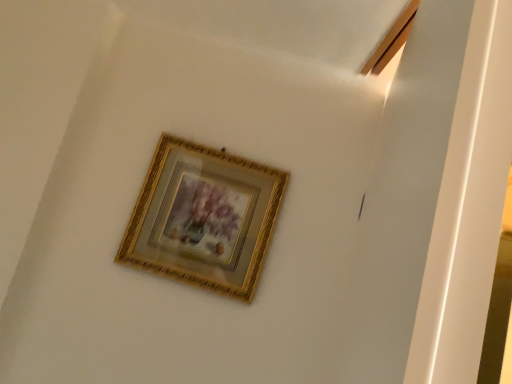
Describe the element at coordinates (204, 218) in the screenshot. This screenshot has width=512, height=384. I see `gold/gilded picture frame at upper center` at that location.

The height and width of the screenshot is (384, 512). I want to click on gold/gilded picture frame at upper center, so click(204, 218).

This screenshot has height=384, width=512. In order to click on gold/gilded picture frame at upper center in this screenshot , I will do `click(204, 218)`.